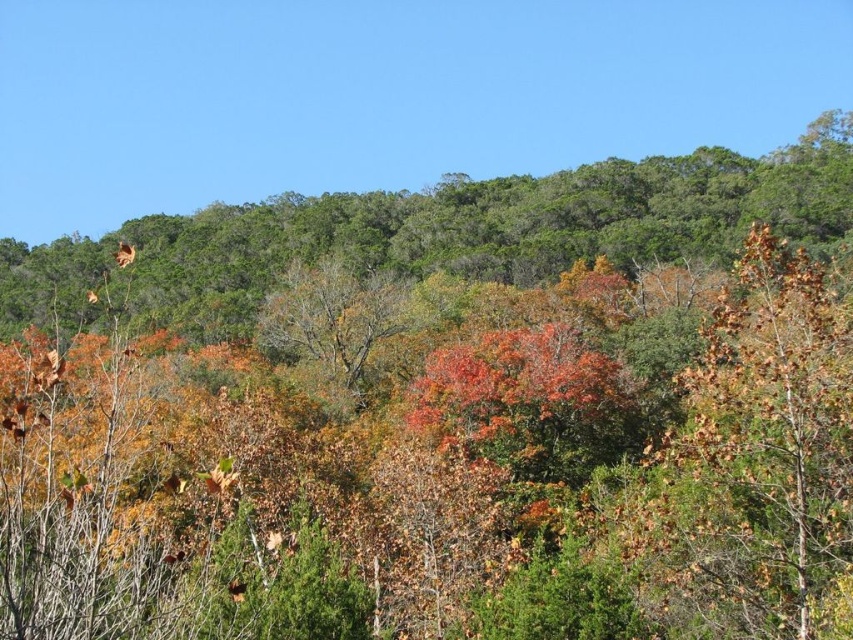
You are standing in the forest and see two points marked in the image. The first point is at coordinates point (807, 403) and the second is at point (276, 307). Which point is closer to you?

Point (807, 403) is in front of point (276, 307), so it is closer to you.

You are standing in the forest and see a point marked at coordinates (x=756, y=454). What type of ground cover is this point located on?

The point is located on brown dried leaves at the right side of the image.